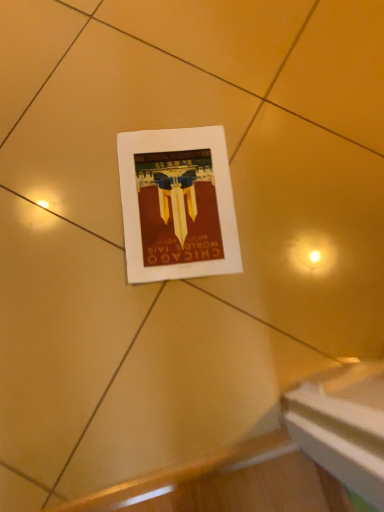
In order to click on free region under white paper at center (from a real-world perspective) in this screenshot , I will do pos(175,203).